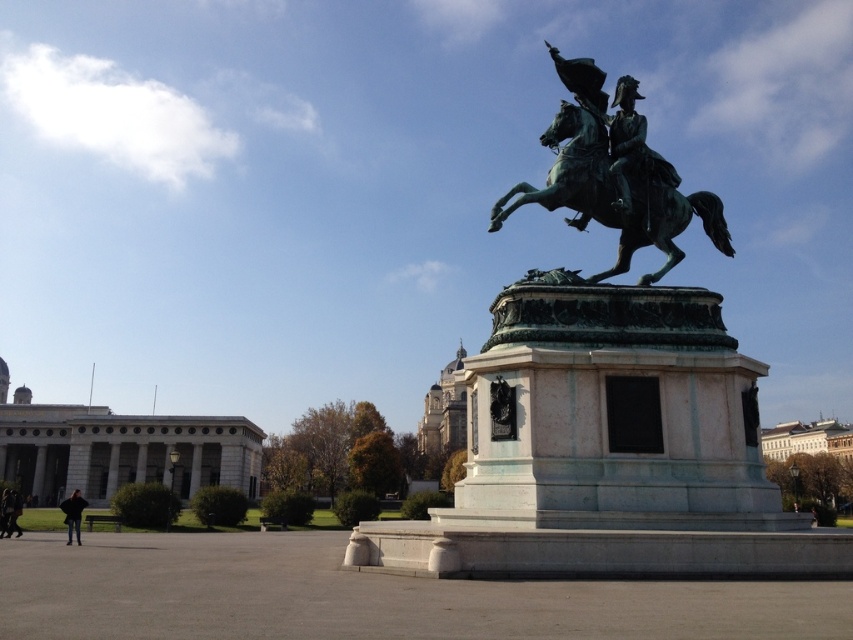
Question: Is green patina horse at center behind dark blue jacket at lower left?

Choices:
 (A) yes
 (B) no

Answer: (B)

Question: Which point appears closest to the camera in this image?

Choices:
 (A) (598, 150)
 (B) (76, 508)
 (C) (641, 141)
 (D) (646, 474)

Answer: (D)

Question: Can you confirm if green patina horse at center is bigger than green patina statue at upper center?

Choices:
 (A) yes
 (B) no

Answer: (A)

Question: Based on their relative distances, which object is nearer to the dark blue jacket at lower left?

Choices:
 (A) green patina horse at center
 (B) green patina statue at upper center

Answer: (A)

Question: Which point is farther from the camera taking this photo?

Choices:
 (A) (689, 208)
 (B) (624, 205)
 (C) (76, 532)
 (D) (540, 141)

Answer: (C)

Question: Is green patina horse at center above green patina statue at upper center?

Choices:
 (A) no
 (B) yes

Answer: (B)